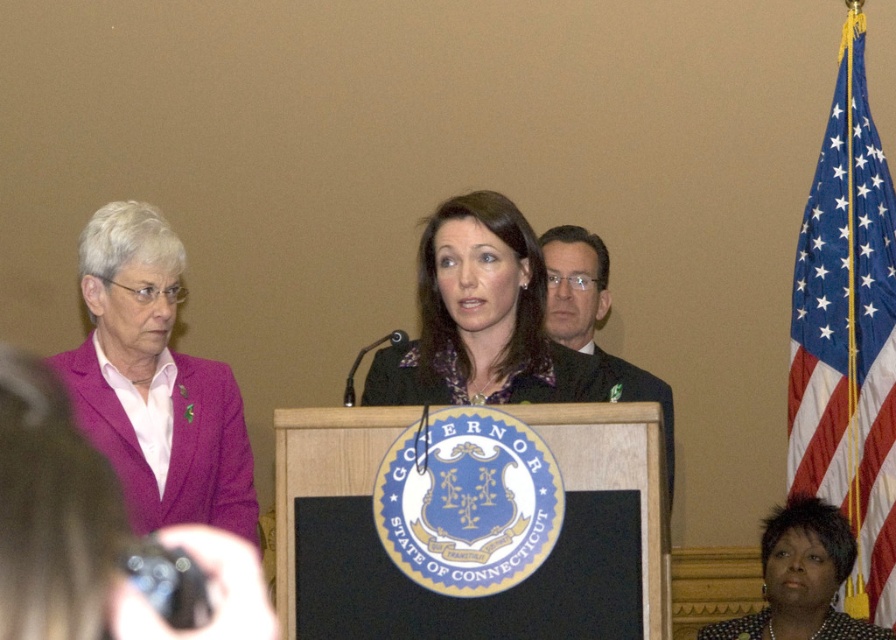
Based on the coordinates provided, which object in the scene is located at point (154, 381)?

The point (154, 381) corresponds to the pink fabric jacket at left.

You are standing in the room where the event is happening and want to move directly to the matte black jacket at center. Based on its position, which direction should you move from your current position if you are facing the podium?

Since the matte black jacket at center is located at coordinates approximately 0.5 in both x and y directions, it is centrally positioned in the image. If you are facing the podium, you should move straight ahead towards the center of the room to reach the matte black jacket at center.

You are an event planner arranging seating for a follow up meeting. You need to seat the person in the pink fabric jacket at left and the person in the dark suit at center. If the table is narrow, which person might need a wider seat?

The pink fabric jacket at left is wider than the dark suit at center, so the person wearing the pink fabric jacket at left would need a wider seat.